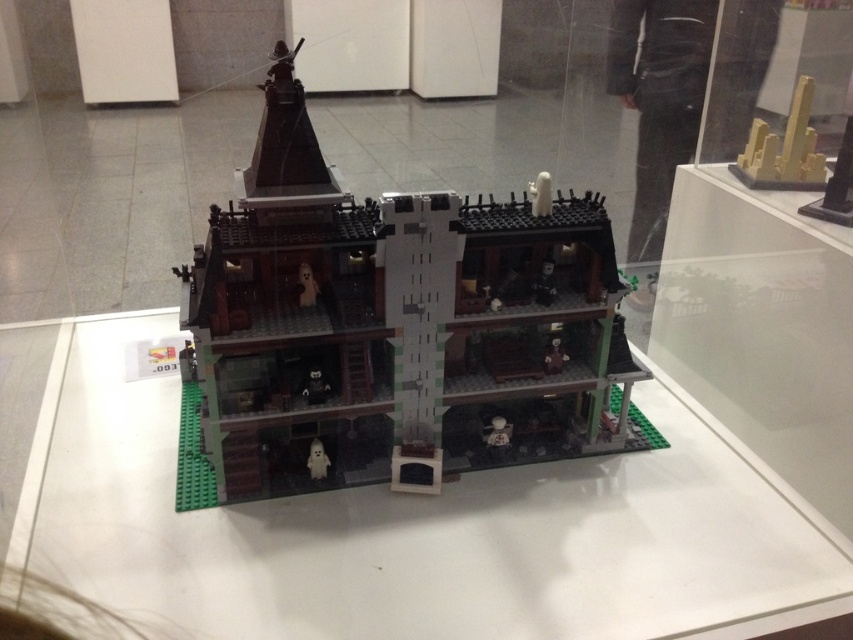
Question: Can you confirm if brick-like lego house at center is positioned to the left of yellow matte cityscape at upper right?

Choices:
 (A) yes
 (B) no

Answer: (A)

Question: Which of the following is the closest to the observer?

Choices:
 (A) (306, 365)
 (B) (804, 186)

Answer: (A)

Question: Is yellow matte cityscape at upper right positioned before translucent white ghost at center?

Choices:
 (A) no
 (B) yes

Answer: (A)

Question: Which object is positioned closest to the translucent white ghost at center?

Choices:
 (A) brick-like lego house at center
 (B) yellow matte cityscape at upper right

Answer: (A)

Question: Can you confirm if brick-like lego house at center is wider than yellow matte cityscape at upper right?

Choices:
 (A) yes
 (B) no

Answer: (A)

Question: Which object is farther from the camera taking this photo?

Choices:
 (A) brick-like lego house at center
 (B) translucent white ghost at center
 (C) yellow matte cityscape at upper right

Answer: (C)